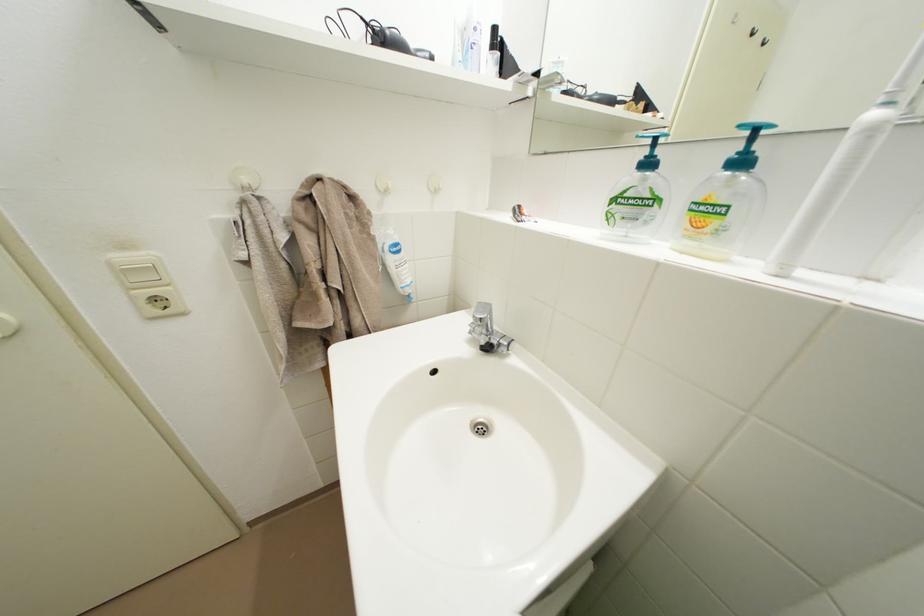
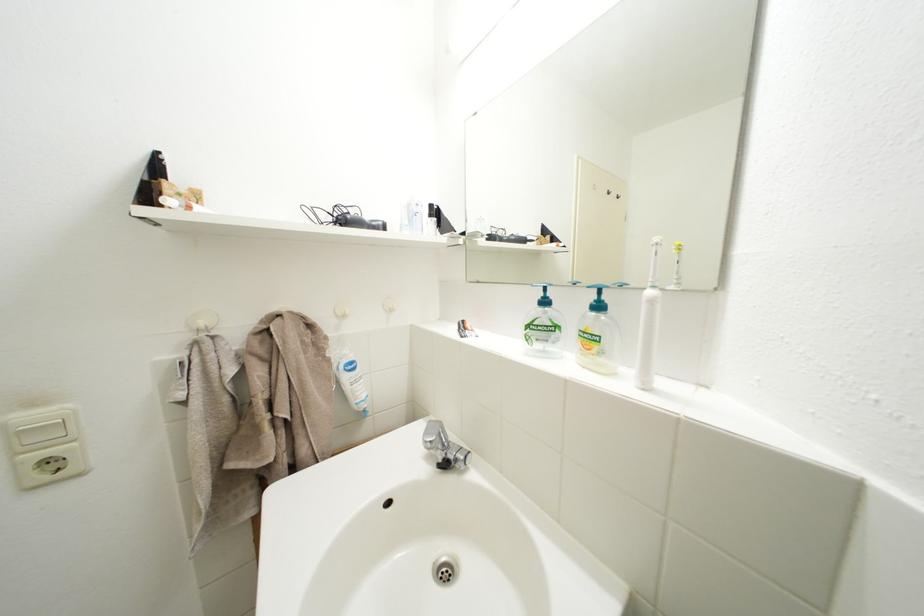
The point at (492, 318) is marked in the first image. Where is the corresponding point in the second image?

(441, 440)